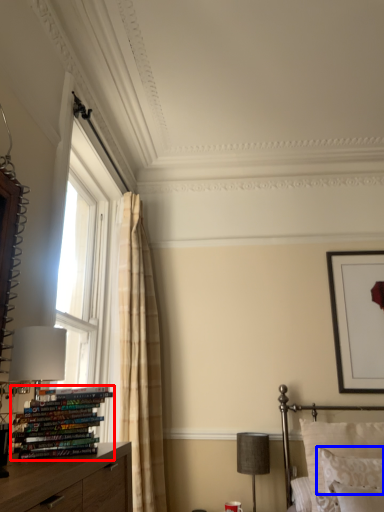
Question: Which object appears closest to the camera in this image, book (highlighted by a red box) or pillow (highlighted by a blue box)?

Choices:
 (A) book
 (B) pillow

Answer: (A)